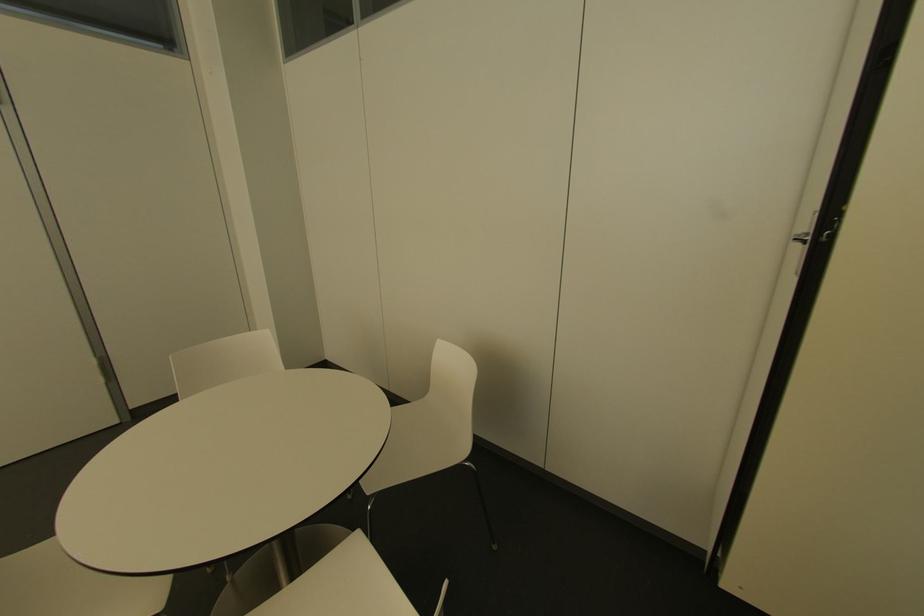
This screenshot has height=616, width=924. I want to click on silver door handle, so click(x=800, y=238).